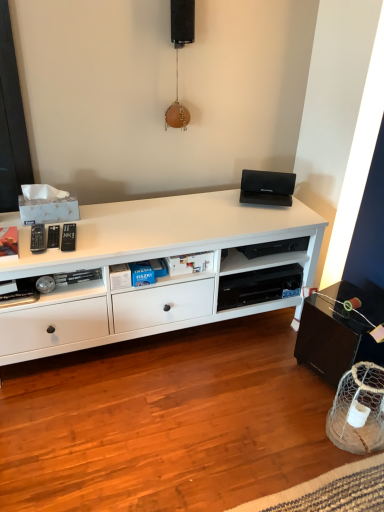
I want to click on free space above white matte cabinet at center (from a real-world perspective), so click(x=163, y=220).